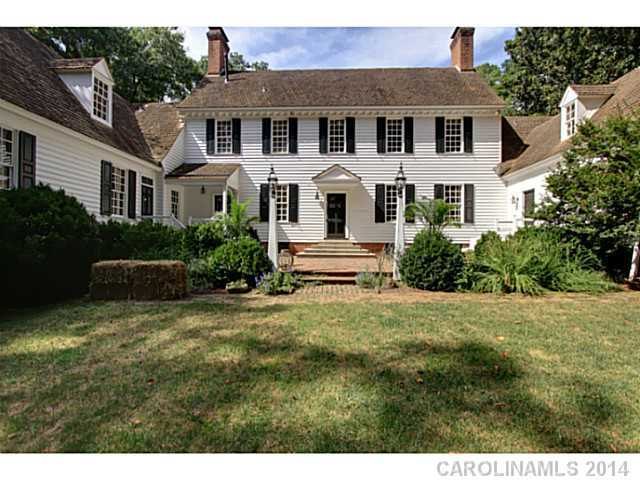
At what (x,y) coordinates should I click in order to perform the action: click on chimney. Please return your answer as a coordinate pair (x, y). Looking at the image, I should click on (207, 64).